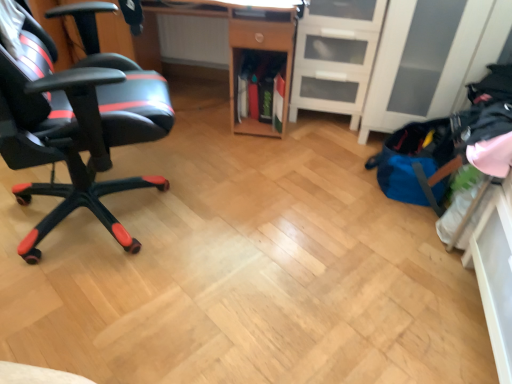
What do you see at coordinates (76, 127) in the screenshot? I see `black matte gaming chair at left` at bounding box center [76, 127].

Find the location of a particular element. The image size is (512, 384). white matte file cabinet at center right is located at coordinates (335, 56).

Is wooden desk at center facing towards black matte gaming chair at left?

Yes, wooden desk at center is oriented towards black matte gaming chair at left.

You are a GUI agent. You are given a task and a screenshot of the screen. Output one action in this format:
    pyautogui.click(x=<x>, y=<y>)
    Task: Click on the desk lying above the black matte gaming chair at left (from the image's perspective)
    Image resolution: width=512 pixels, height=384 pixels.
    Given the screenshot: What is the action you would take?
    pyautogui.click(x=233, y=41)

From the image's perspective, between wooden desk at center and black matte gaming chair at left, who is located below?

black matte gaming chair at left, from the image's perspective.

Relative to black matte gaming chair at left, is wooden desk at center in front or behind?

In the image, wooden desk at center appears behind black matte gaming chair at left.

Is there a large distance between wooden desk at center and white matte file cabinet at center right?

wooden desk at center is actually quite close to white matte file cabinet at center right.

Considering the sizes of wooden desk at center and white matte file cabinet at center right in the image, is wooden desk at center wider or thinner than white matte file cabinet at center right?

wooden desk at center is wider than white matte file cabinet at center right.

From the image's perspective, is wooden desk at center positioned above or below white matte file cabinet at center right?

Clearly, from the image's perspective, wooden desk at center is below white matte file cabinet at center right.

Considering the relative sizes of black matte gaming chair at left and wooden desk at center in the image provided, is black matte gaming chair at left taller than wooden desk at center?

Correct, black matte gaming chair at left is much taller as wooden desk at center.

Is black matte gaming chair at left directly adjacent to wooden desk at center?

No, black matte gaming chair at left is not touching wooden desk at center.

Is point (92, 157) farther from viewer compared to point (84, 4)?

No, it is in front of (84, 4).

From the image's perspective, is black matte gaming chair at left below wooden desk at center?

Indeed, from the image's perspective, black matte gaming chair at left is shown beneath wooden desk at center.

From the image's perspective, who appears lower, white matte file cabinet at center right or black matte gaming chair at left?

black matte gaming chair at left appears lower in the image.

From a real-world perspective, relative to black matte gaming chair at left, is white matte file cabinet at center right vertically above or below?

Clearly, from a real-world perspective, white matte file cabinet at center right is below black matte gaming chair at left.

Considering the relative sizes of white matte file cabinet at center right and black matte gaming chair at left in the image provided, is white matte file cabinet at center right bigger than black matte gaming chair at left?

Incorrect, white matte file cabinet at center right is not larger than black matte gaming chair at left.

Considering the positions of point (297, 93) and point (128, 142), is point (297, 93) closer or farther from the camera than point (128, 142)?

Point (297, 93) appears to be farther away from the viewer than point (128, 142).

From the image's perspective, does black matte gaming chair at left appear lower than white matte file cabinet at center right?

Yes.

Does black matte gaming chair at left have a greater width compared to white matte file cabinet at center right?

Correct, the width of black matte gaming chair at left exceeds that of white matte file cabinet at center right.

Looking at this image, would you say white matte file cabinet at center right is part of black matte gaming chair at left's contents?

That's incorrect, white matte file cabinet at center right is not inside black matte gaming chair at left.

Would you say white matte file cabinet at center right is outside wooden desk at center?

Yes, white matte file cabinet at center right is outside of wooden desk at center.

From a real-world perspective, relative to wooden desk at center, is white matte file cabinet at center right vertically above or below?

white matte file cabinet at center right is situated lower than wooden desk at center in the real world.

How many degrees apart are the facing directions of white matte file cabinet at center right and wooden desk at center?

There is a 3.99-degree angle between the facing directions of white matte file cabinet at center right and wooden desk at center.

Would you say white matte file cabinet at center right is a long distance from wooden desk at center?

No, white matte file cabinet at center right is not far away from wooden desk at center.

Locate an element on the screen. This screenshot has height=384, width=512. chair on the left of wooden desk at center is located at coordinates (76, 127).

This screenshot has height=384, width=512. In order to click on file cabinet on the right side of wooden desk at center in this screenshot , I will do `click(335, 56)`.

When comparing their distances from white matte file cabinet at center right, does black matte gaming chair at left or wooden desk at center seem further?

Among the two, black matte gaming chair at left is located further to white matte file cabinet at center right.

From the image, which object appears to be nearer to black matte gaming chair at left, wooden desk at center or white matte file cabinet at center right?

Among the two, wooden desk at center is located nearer to black matte gaming chair at left.

From the image, which object appears to be farther from black matte gaming chair at left, white matte file cabinet at center right or wooden desk at center?

The object further to black matte gaming chair at left is white matte file cabinet at center right.

Based on their spatial positions, is wooden desk at center or black matte gaming chair at left further from white matte file cabinet at center right?

black matte gaming chair at left.

When comparing their distances from wooden desk at center, does white matte file cabinet at center right or black matte gaming chair at left seem further?

black matte gaming chair at left is further to wooden desk at center.

Considering their positions, is black matte gaming chair at left positioned further to wooden desk at center than white matte file cabinet at center right?

black matte gaming chair at left lies further to wooden desk at center than the other object.

At what (x,y) coordinates should I click in order to perform the action: click on desk between black matte gaming chair at left and white matte file cabinet at center right. Please return your answer as a coordinate pair (x, y). This screenshot has height=384, width=512. Looking at the image, I should click on (233, 41).